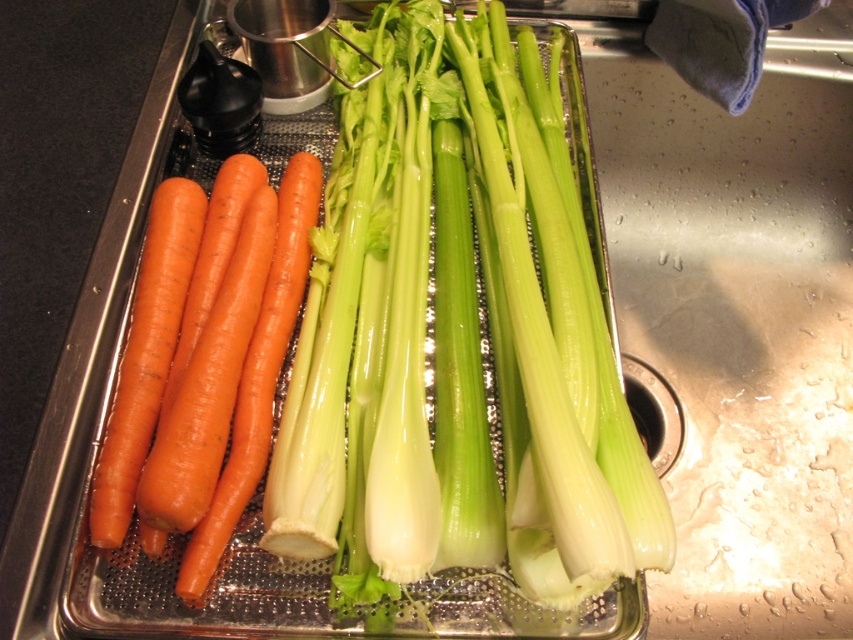
Does green glossy celery at center lie behind orange matte carrot at left?

That is False.

Can you confirm if green glossy celery at center is smaller than orange matte carrot at left?

No, green glossy celery at center is not smaller than orange matte carrot at left.

The width and height of the screenshot is (853, 640). Find the location of `green glossy celery at center`. green glossy celery at center is located at coordinates [x=456, y=339].

Does point (276, 339) lie behind point (173, 273)?

No.

Is orange matte carrots at left thinner than orange matte carrot at left?

Incorrect, orange matte carrots at left's width is not less than orange matte carrot at left's.

Does point (260, 394) lie behind point (131, 428)?

Yes, it is.

Locate an element on the screen. orange matte carrots at left is located at coordinates (228, 372).

Is green glossy celery at center to the left of orange matte carrots at left from the viewer's perspective?

In fact, green glossy celery at center is to the right of orange matte carrots at left.

Who is positioned more to the right, green glossy celery at center or orange matte carrots at left?

Positioned to the right is green glossy celery at center.

Is point (308, 435) in front of point (189, 296)?

That is True.

Where is `green glossy celery at center`? green glossy celery at center is located at coordinates (456, 339).